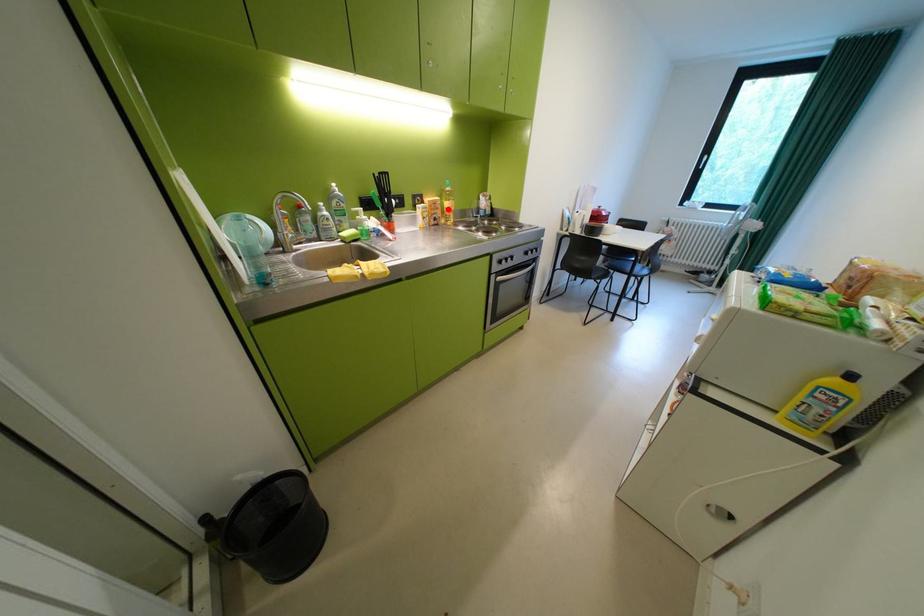
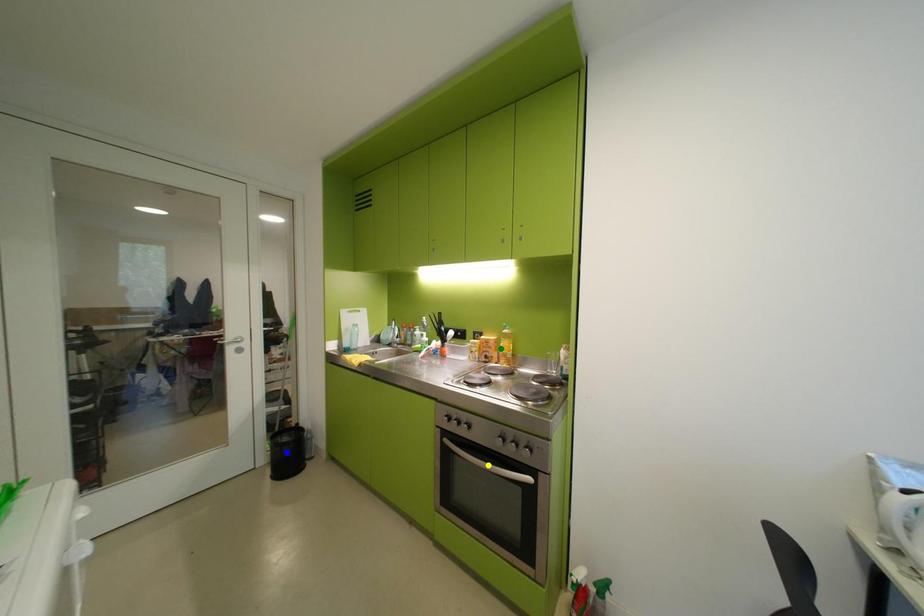
Question: I am providing you with two images of the same scene from different viewpoints. A red point is marked on the first image. You are given multiple points on the second image. In image 2, which mark is for the same physical point as the one in image 1?

Choices:
 (A) yellow point
 (B) green point
 (C) blue point

Answer: (B)